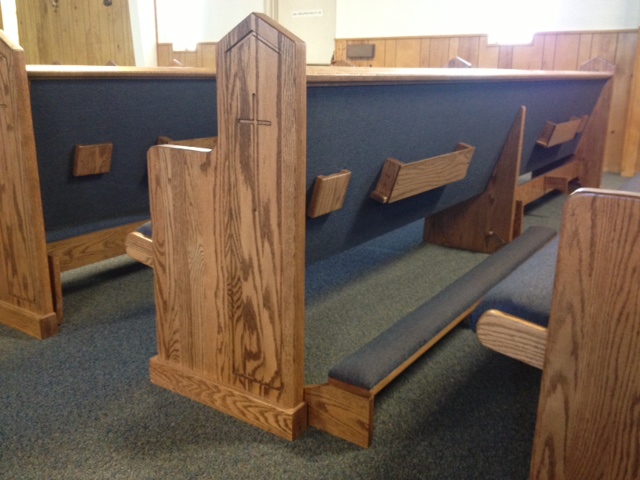
I want to click on bible and hymnal storage, so click(x=438, y=173), click(x=564, y=129).